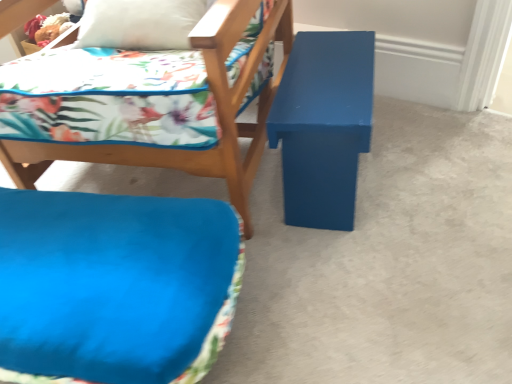
Locate an element on the screen. This screenshot has height=384, width=512. free point above blue fabric cushion at lower left (from a real-world perspective) is located at coordinates (88, 256).